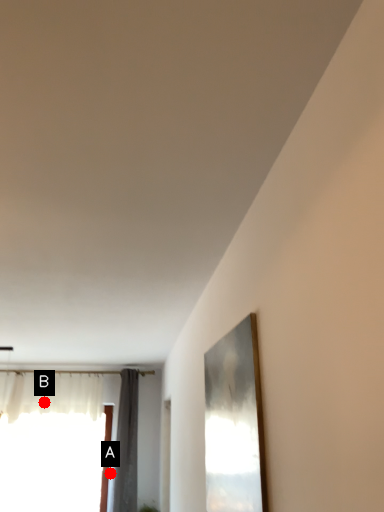
Question: Two points are circled on the image, labeled by A and B beside each circle. Which of the following is the farthest from the observer?

Choices:
 (A) A is further
 (B) B is further

Answer: (A)